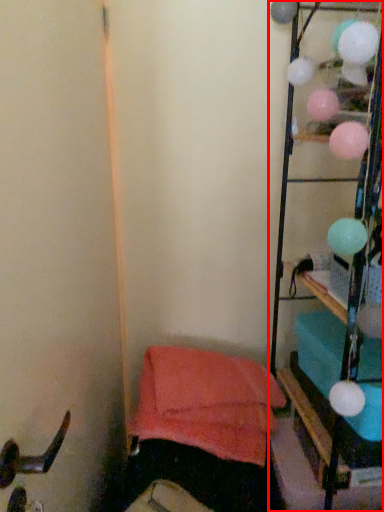
Question: From the image's perspective, where is furniture (annotated by the red box) located relative to bean bag chair?

Choices:
 (A) below
 (B) above

Answer: (B)